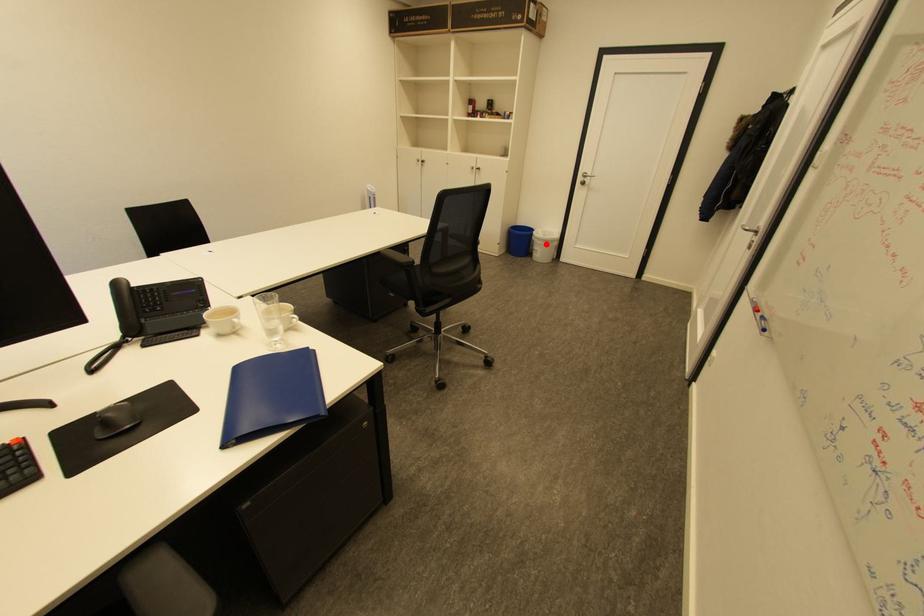
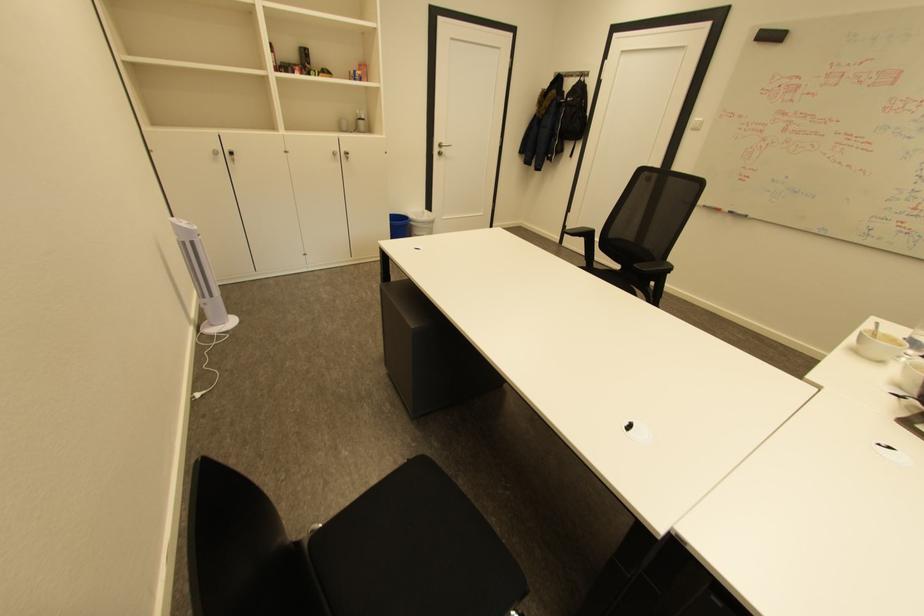
Question: I am providing you with two images of the same scene from different viewpoints. A red point is shown in image1. For the corresponding object point in image2, is it positioned nearer or farther from the camera?

Choices:
 (A) Nearer
 (B) Farther

Answer: (B)